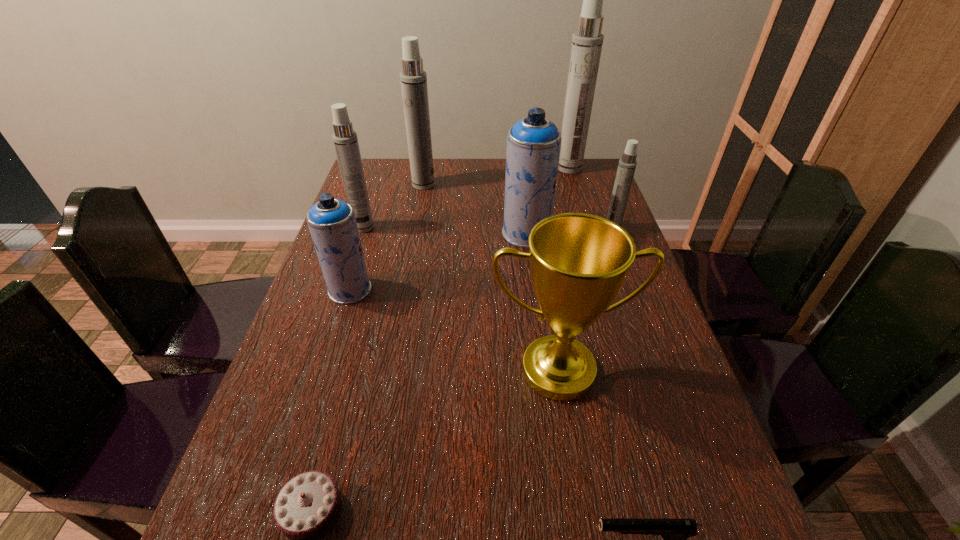
This screenshot has width=960, height=540. What are the coordinates of `the third white aerosol can from left to right` in the screenshot? It's located at (587, 41).

Image resolution: width=960 pixels, height=540 pixels. What are the coordinates of `the farthest object` in the screenshot? It's located at (587, 41).

The image size is (960, 540). Identify the location of the second farthest aerosol can. (413, 78).

Where is `the eighth shortest object`? Image resolution: width=960 pixels, height=540 pixels. the eighth shortest object is located at coordinates (413, 78).

This screenshot has width=960, height=540. I want to click on the second smallest white aerosol can, so click(345, 139).

Identify the location of the farther blue aerosol can. The width and height of the screenshot is (960, 540). (533, 144).

I want to click on the right blue aerosol can, so coord(533,144).

Where is `award`? The width and height of the screenshot is (960, 540). award is located at coordinates (578, 262).

I want to click on gold award, so 578,262.

This screenshot has height=540, width=960. Identify the location of the rightmost aerosol can. (627, 164).